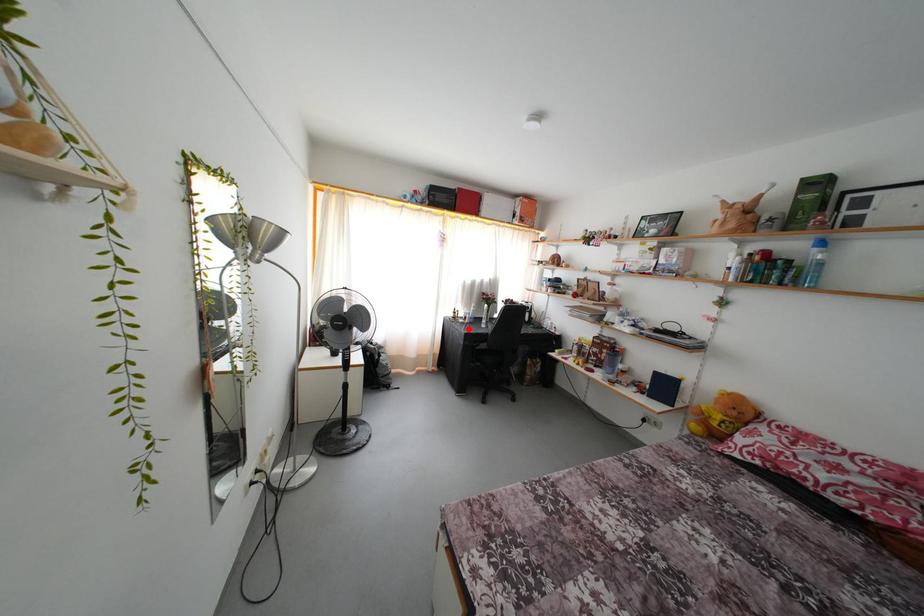
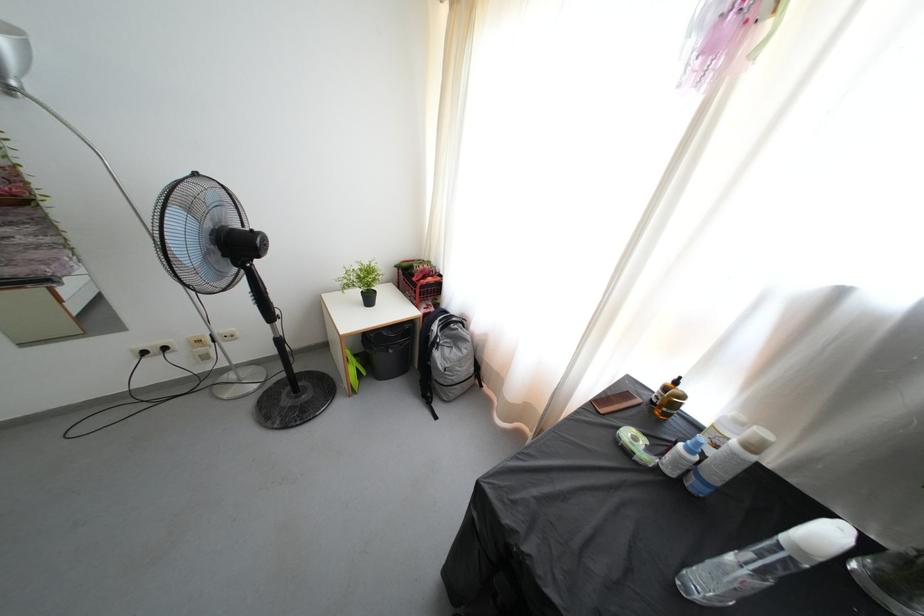
Locate, in the second image, the point that corresponds to the highlighted location in the first image.

(631, 458)